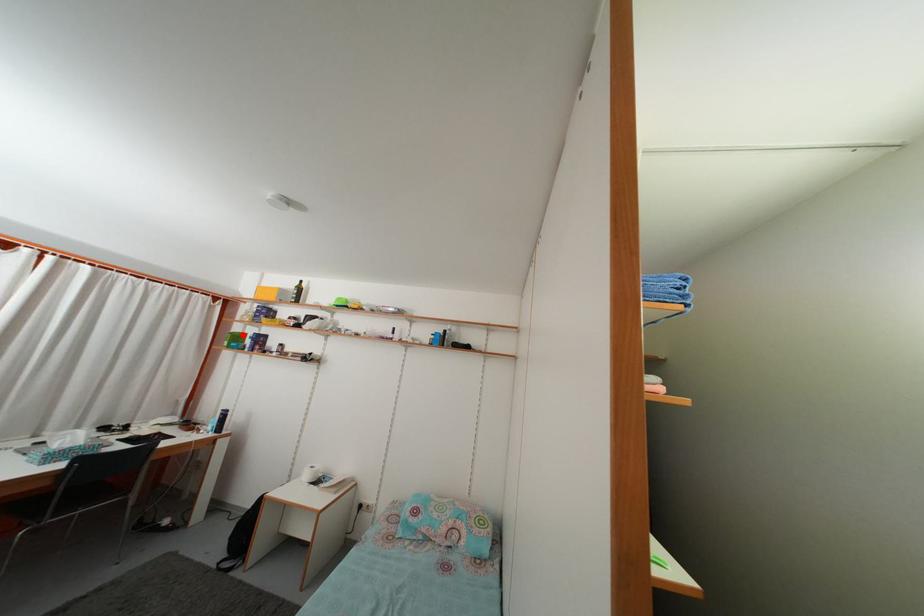
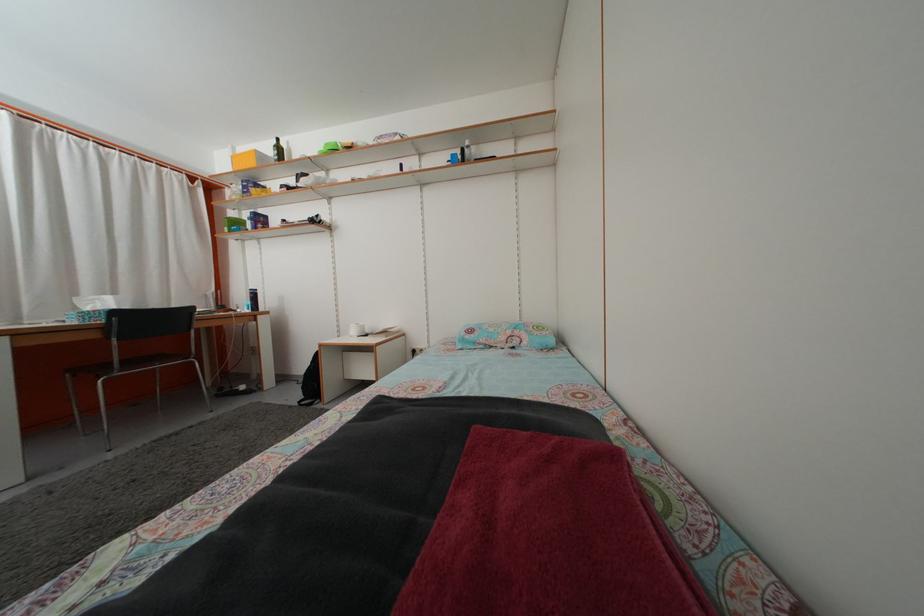
Question: A red point is marked in image1. In image2, is the corresponding 3D point closer to the camera or farther? Reply with the corresponding letter.

Choices:
 (A) The corresponding 3D point is closer.
 (B) The corresponding 3D point is farther.

Answer: (A)